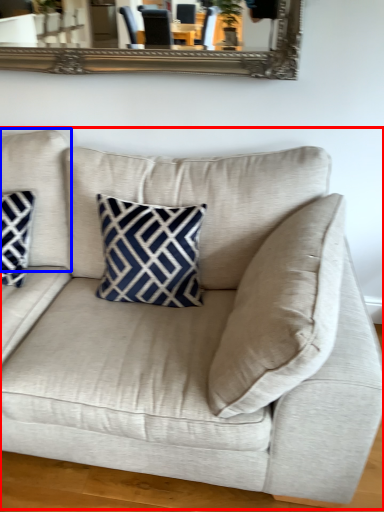
Question: Which object is closer to the camera taking this photo, studio couch (highlighted by a red box) or pillow (highlighted by a blue box)?

Choices:
 (A) studio couch
 (B) pillow

Answer: (A)